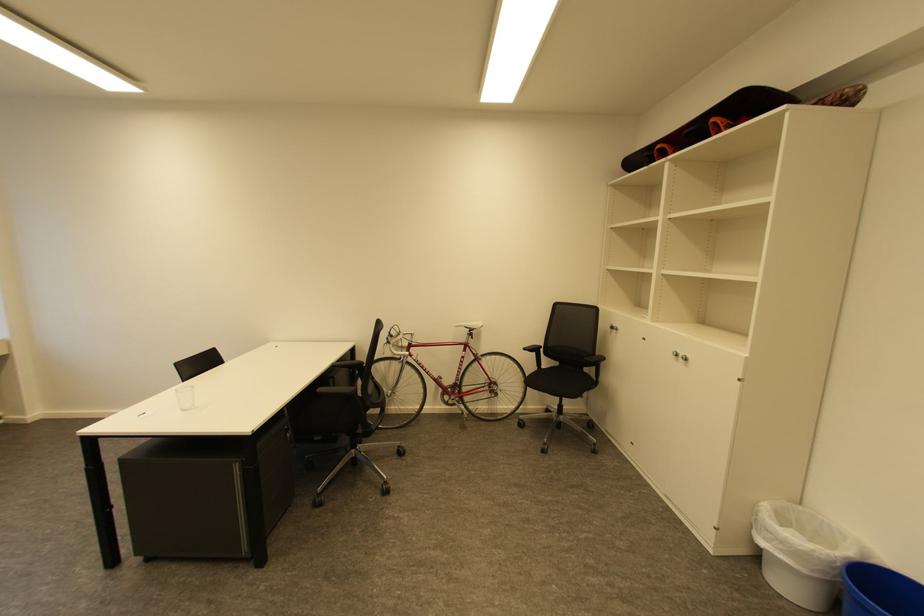
The location [801,553] corresponds to which object?

It refers to a white trash can.